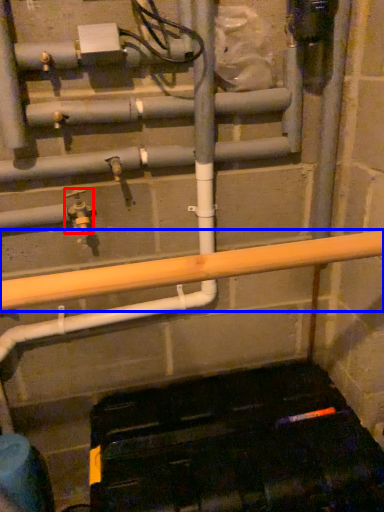
Question: Which point is further to the camera, plumbing fixture (highlighted by a red box) or beam (highlighted by a blue box)?

Choices:
 (A) plumbing fixture
 (B) beam

Answer: (A)